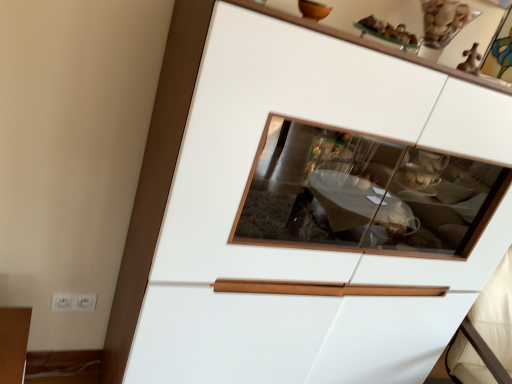
The image size is (512, 384). What do you see at coordinates (500, 52) in the screenshot?
I see `wooden picture frame at upper right` at bounding box center [500, 52].

Locate an element on the screen. The width and height of the screenshot is (512, 384). wooden picture frame at upper right is located at coordinates (500, 52).

Identify the location of wooden picture frame at upper right. This screenshot has height=384, width=512. (500, 52).